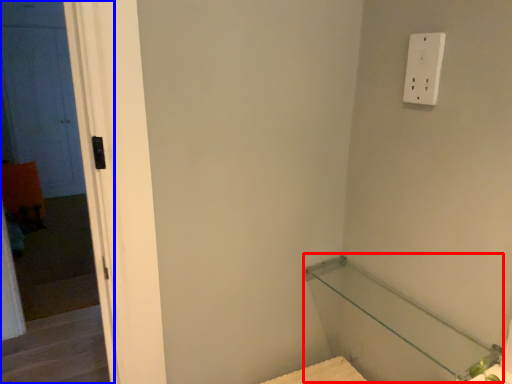
Question: Which object appears farthest to the camera in this image, balustrade (highlighted by a red box) or screen door (highlighted by a blue box)?

Choices:
 (A) balustrade
 (B) screen door

Answer: (B)